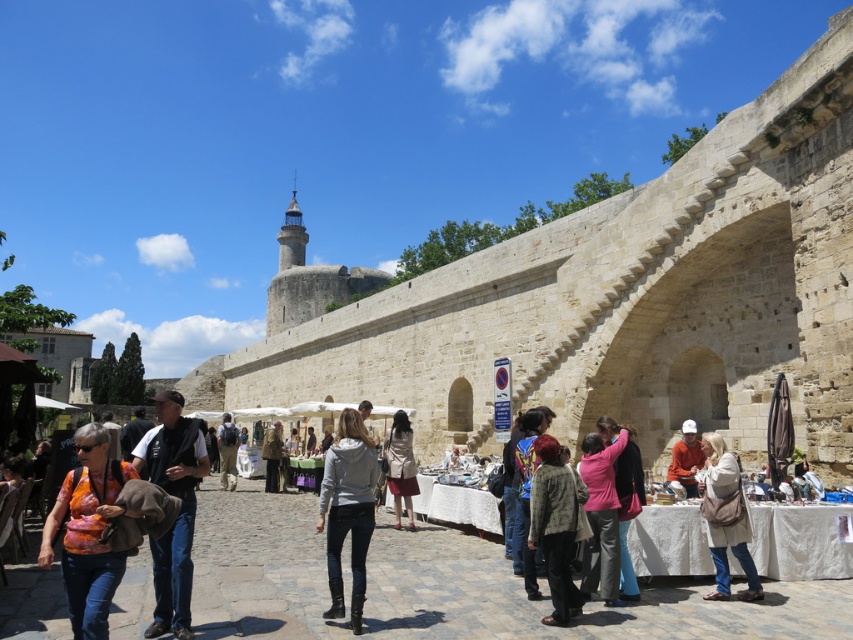
Question: Can you confirm if light brown leather jacket at lower right is positioned below beige fabric coat at center?

Choices:
 (A) no
 (B) yes

Answer: (A)

Question: Which object appears closest to the camera in this image?

Choices:
 (A) leather jacket at center
 (B) gray matte hoodie at center
 (C) khaki cotton backpack at center

Answer: (B)

Question: Which is nearer to the pink fabric jacket at center?

Choices:
 (A) pink fabric at center
 (B) light brown fur coat at lower right
 (C) multicolored fabric at center
 (D) beige fabric coat at center

Answer: (A)

Question: Is pink fabric jacket at center closer to camera compared to beige fabric coat at center?

Choices:
 (A) no
 (B) yes

Answer: (B)

Question: Is the position of gray matte hoodie at center more distant than that of light brown leather jacket at lower right?

Choices:
 (A) no
 (B) yes

Answer: (A)

Question: Which is nearer to the light beige stone fort at center?

Choices:
 (A) printed cotton shirt at lower left
 (B) multicolored fabric at center
 (C) khaki cotton backpack at center

Answer: (C)